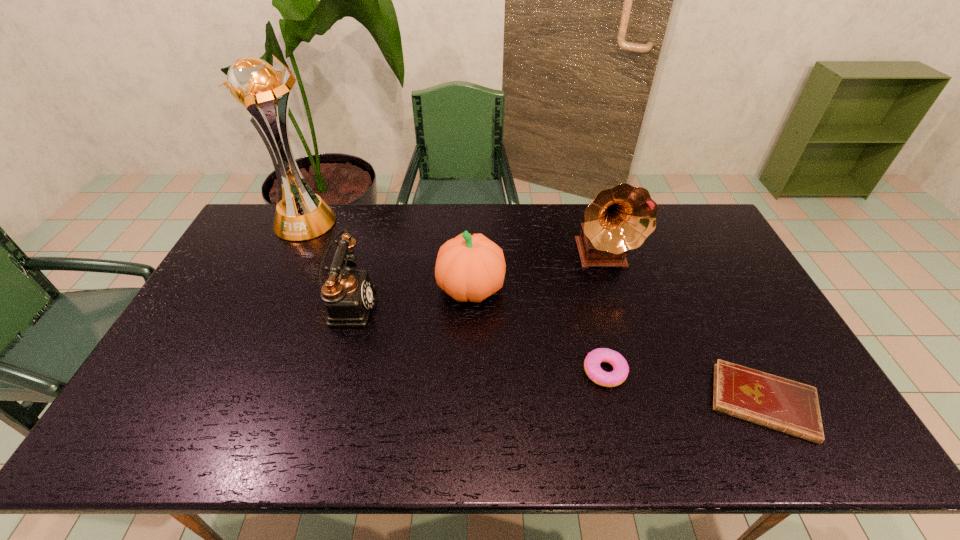
This screenshot has height=540, width=960. What are the coordinates of `the leftmost object` in the screenshot? It's located at (254, 85).

Identify the location of trophy. This screenshot has width=960, height=540. (254, 85).

This screenshot has width=960, height=540. What are the coordinates of `the second tallest object` in the screenshot? It's located at (619, 219).

Find the location of a particular element. The width and height of the screenshot is (960, 540). the third object from left to right is located at coordinates (469, 267).

Image resolution: width=960 pixels, height=540 pixels. Identify the location of the fifth object from right to left. (349, 295).

What are the coordinates of `the second shortest object` in the screenshot? It's located at (592, 362).

Locate an element on the screen. notebook is located at coordinates (771, 401).

Locate an element on the screen. The height and width of the screenshot is (540, 960). the rightmost object is located at coordinates (771, 401).

I want to click on free space located 0.080m on the front-facing side of the trophy, so click(288, 257).

You are a GUI agent. You are given a task and a screenshot of the screen. Output one action in this format:
    pyautogui.click(x=<x>, y=<y>)
    Task: Click on the vacant space located on the horn of the phonograph_record
    The width and height of the screenshot is (960, 540).
    Given the screenshot: What is the action you would take?
    pyautogui.click(x=627, y=339)